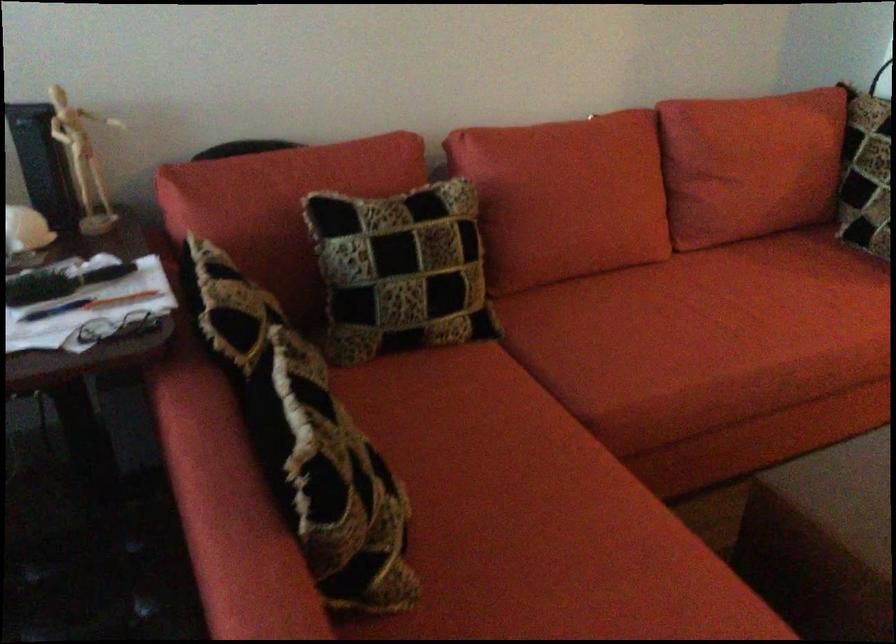
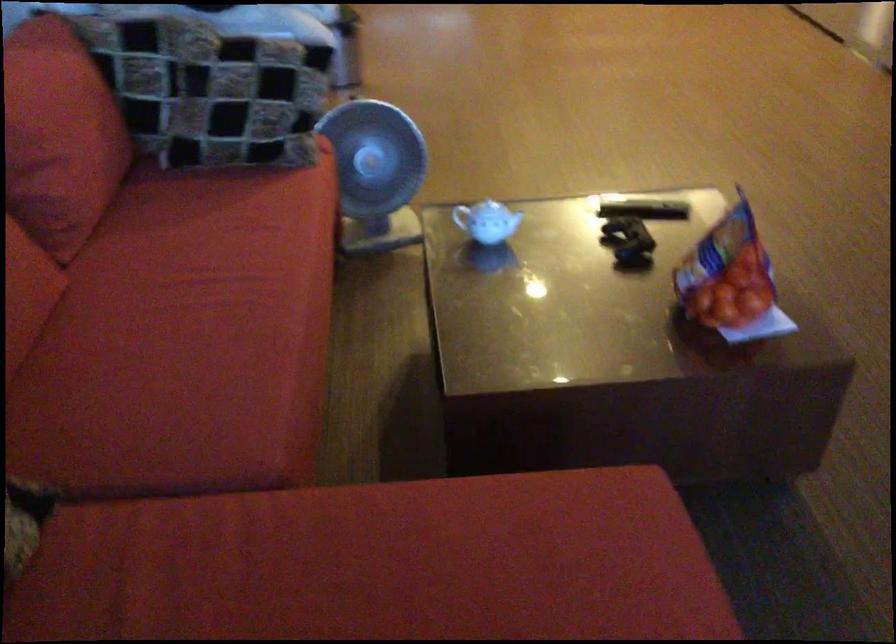
The first image is from the beginning of the video and the second image is from the end. How did the camera likely rotate when shooting the video?

The camera's rotation is toward right-down.